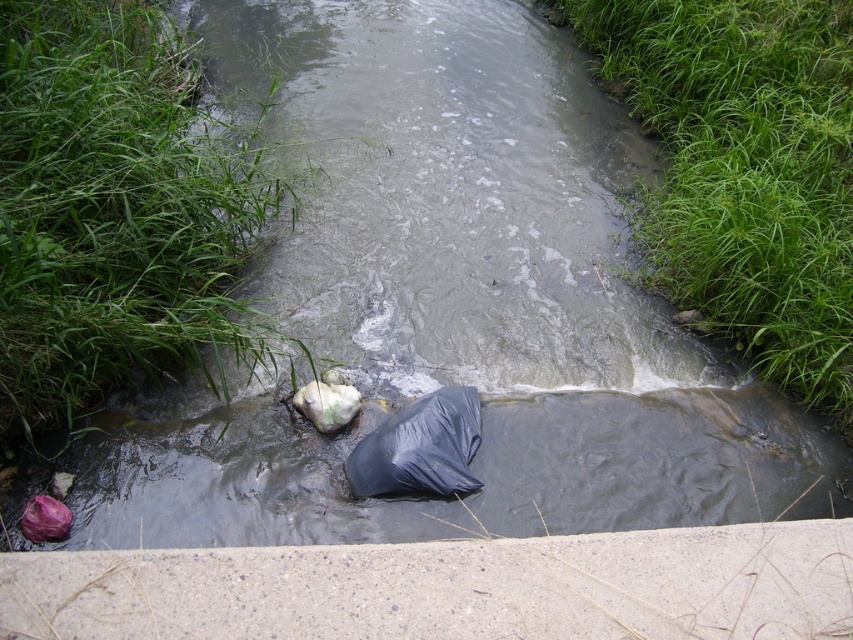
Question: Which point is closer to the camera?

Choices:
 (A) (846, 321)
 (B) (450, 458)
 (C) (224, 387)

Answer: (B)

Question: Does green grass at upper right appear over black plastic bag at center?

Choices:
 (A) yes
 (B) no

Answer: (A)

Question: Which object is the farthest from the green grass at lower left?

Choices:
 (A) green grass at upper right
 (B) black plastic bag at center

Answer: (A)

Question: Does green grass at lower left appear on the right side of black plastic bag at center?

Choices:
 (A) no
 (B) yes

Answer: (A)

Question: Which point is closer to the camera?

Choices:
 (A) (448, 397)
 (B) (112, 381)

Answer: (B)

Question: Can you confirm if green grass at lower left is positioned above black plastic bag at center?

Choices:
 (A) yes
 (B) no

Answer: (A)